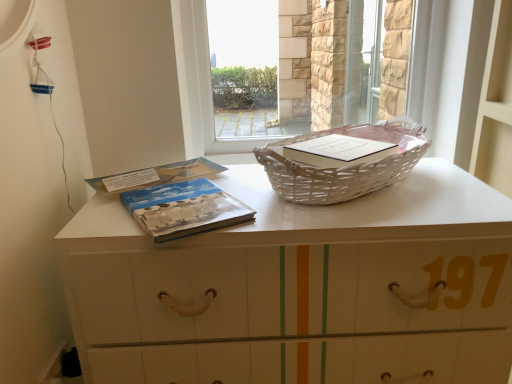
Question: Is white wicker picnic basket at center aimed at blue matte book at center, the second paperback book when ordered from front to back?

Choices:
 (A) yes
 (B) no

Answer: (B)

Question: Is white wicker picnic basket at center oriented away from blue matte book at center, which is counted as the first paperback book, starting from the back?

Choices:
 (A) no
 (B) yes

Answer: (A)

Question: From a real-world perspective, is white wicker picnic basket at center beneath blue matte book at center, the second paperback book when ordered from front to back?

Choices:
 (A) yes
 (B) no

Answer: (B)

Question: Does white wicker picnic basket at center have a greater height compared to blue matte book at center, which is counted as the first paperback book, starting from the back?

Choices:
 (A) yes
 (B) no

Answer: (A)

Question: Considering the relative positions of white wicker picnic basket at center and blue matte book at center, which is counted as the first paperback book, starting from the back, in the image provided, is white wicker picnic basket at center to the left of blue matte book at center, which is counted as the first paperback book, starting from the back, from the viewer's perspective?

Choices:
 (A) yes
 (B) no

Answer: (B)

Question: From a real-world perspective, relative to transparent plastic basket at upper center, is white wicker picnic basket at center vertically above or below?

Choices:
 (A) above
 (B) below

Answer: (B)

Question: Looking at their shapes, would you say white wicker picnic basket at center is wider or thinner than transparent plastic basket at upper center?

Choices:
 (A) wide
 (B) thin

Answer: (A)

Question: Visually, is white wicker picnic basket at center positioned to the left or to the right of transparent plastic basket at upper center?

Choices:
 (A) right
 (B) left

Answer: (A)

Question: Is point (410, 119) closer or farther from the camera than point (286, 74)?

Choices:
 (A) closer
 (B) farther

Answer: (A)

Question: Considering the positions of blue matte book at center, the second paperback book when ordered from front to back, and transparent plastic basket at upper center in the image, is blue matte book at center, the second paperback book when ordered from front to back, taller or shorter than transparent plastic basket at upper center?

Choices:
 (A) tall
 (B) short

Answer: (B)

Question: Looking at their shapes, would you say blue matte book at center, the second paperback book when ordered from front to back, is wider or thinner than transparent plastic basket at upper center?

Choices:
 (A) thin
 (B) wide

Answer: (B)

Question: Is blue matte book at center, the second paperback book when ordered from front to back, in front of or behind transparent plastic basket at upper center in the image?

Choices:
 (A) front
 (B) behind

Answer: (A)

Question: Is blue matte book at center, the second paperback book when ordered from front to back, bigger or smaller than transparent plastic basket at upper center?

Choices:
 (A) big
 (B) small

Answer: (B)

Question: Based on their sizes in the image, would you say blue matte book at center, which is counted as the first paperback book, starting from the back, is bigger or smaller than white wicker picnic basket at center?

Choices:
 (A) small
 (B) big

Answer: (A)

Question: From the image's perspective, is blue matte book at center, which is counted as the first paperback book, starting from the back, positioned above or below white wicker picnic basket at center?

Choices:
 (A) below
 (B) above

Answer: (A)